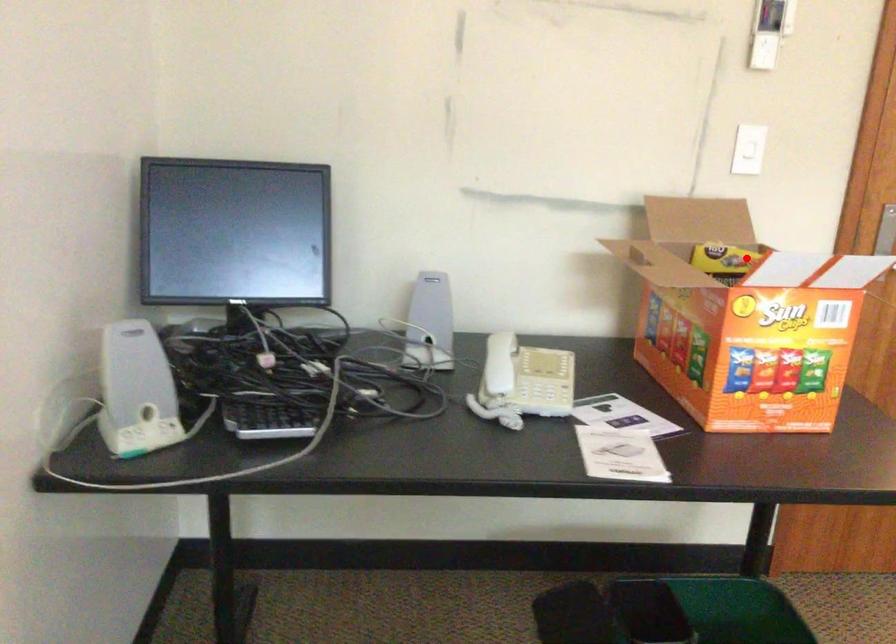
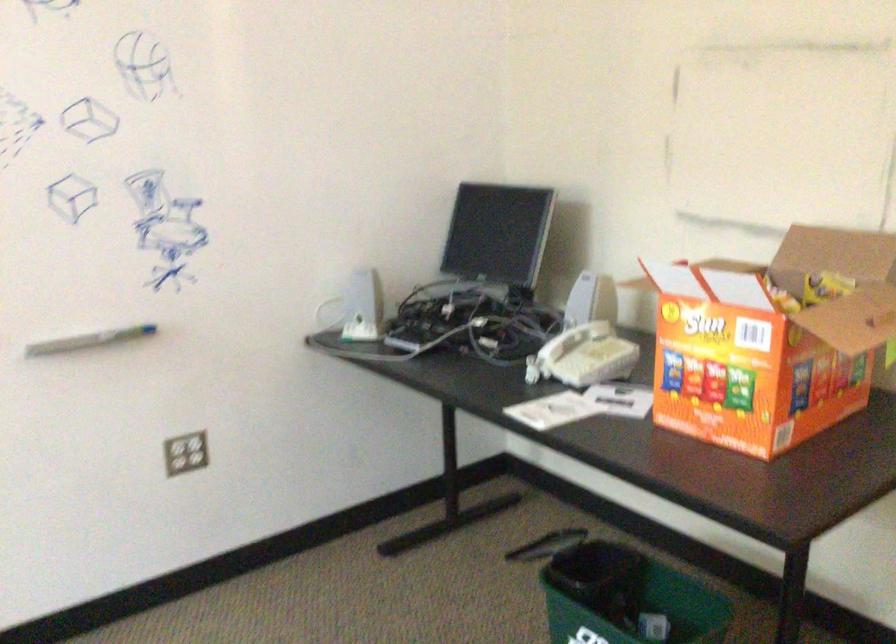
Where in the second image is the point corresponding to the highlighted location from the first image?

(824, 287)